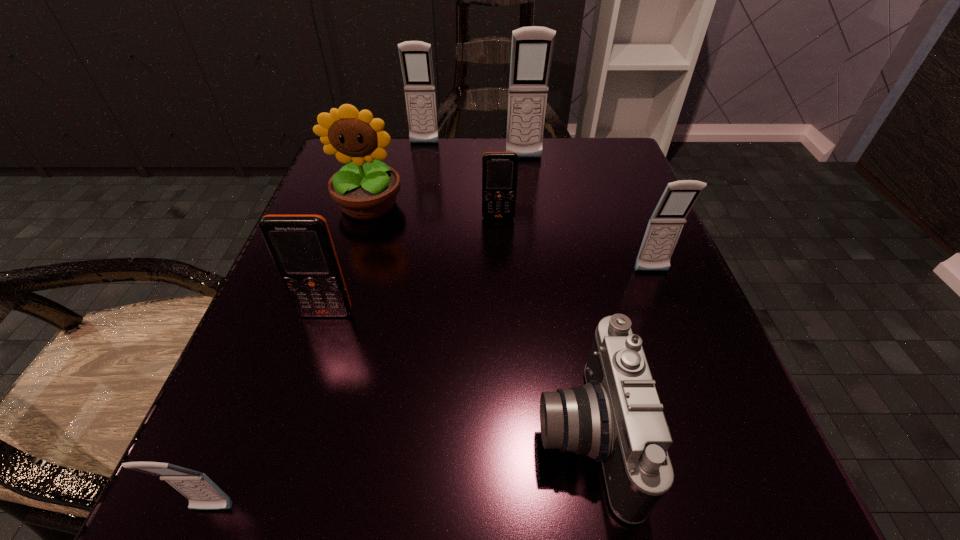
Identify which cellular telephone is the fourth nearest to the third gray cellular telephone from left to right. Please provide its 2D coordinates. Your answer should be formatted as a tuple, i.e. [(x, y)], where the tuple contains the x and y coordinates of a point satisfying the conditions above.

[(301, 246)]

Identify which cellular telephone is located as the nearest to the camera. Please provide its 2D coordinates. Your answer should be formatted as a tuple, i.e. [(x, y)], where the tuple contains the x and y coordinates of a point satisfying the conditions above.

[(666, 223)]

The image size is (960, 540). Find the location of `the third closest gray cellular telephone to the rightmost gray cellular telephone`. the third closest gray cellular telephone to the rightmost gray cellular telephone is located at coordinates (203, 494).

Select which gray cellular telephone appears as the second closest to the rightmost gray cellular telephone. Please provide its 2D coordinates. Your answer should be formatted as a tuple, i.e. [(x, y)], where the tuple contains the x and y coordinates of a point satisfying the conditions above.

[(415, 56)]

Where is `free space that satisfies the following two spatial constraints: 1. on the front-facing side of the black camera; 2. on the front-facing side of the nearest gray cellular telephone`? free space that satisfies the following two spatial constraints: 1. on the front-facing side of the black camera; 2. on the front-facing side of the nearest gray cellular telephone is located at coordinates (598, 510).